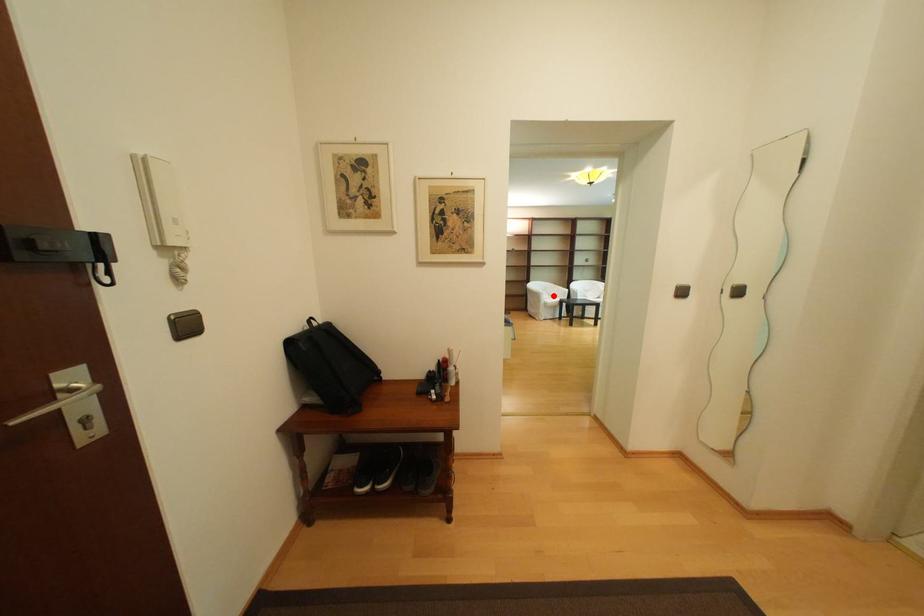
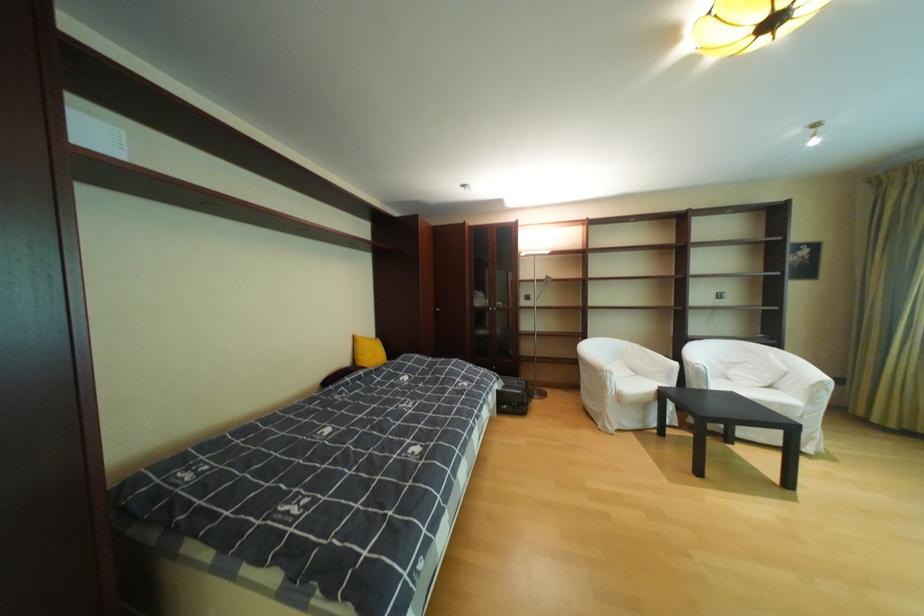
The point at the highlighted location is marked in the first image. Where is the corresponding point in the second image?

(621, 377)